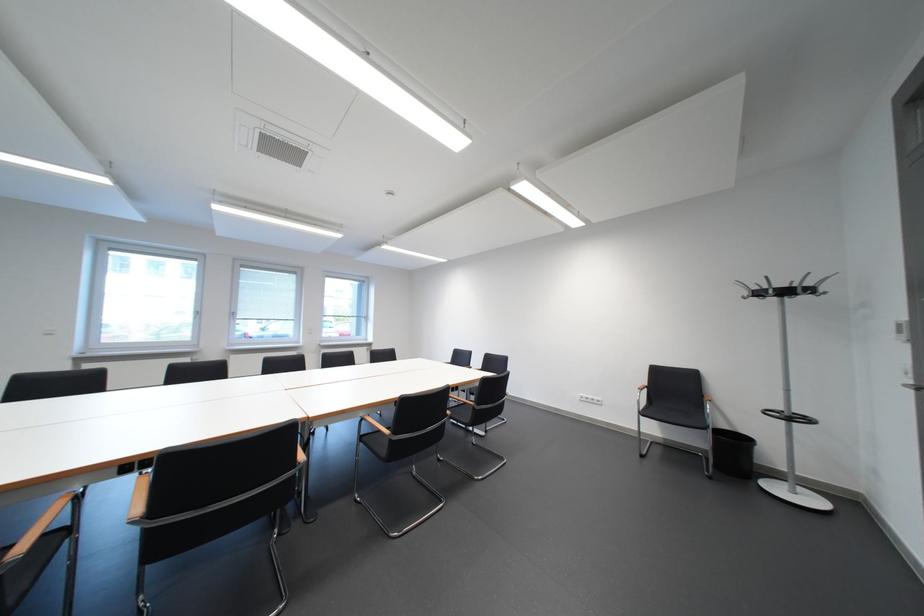
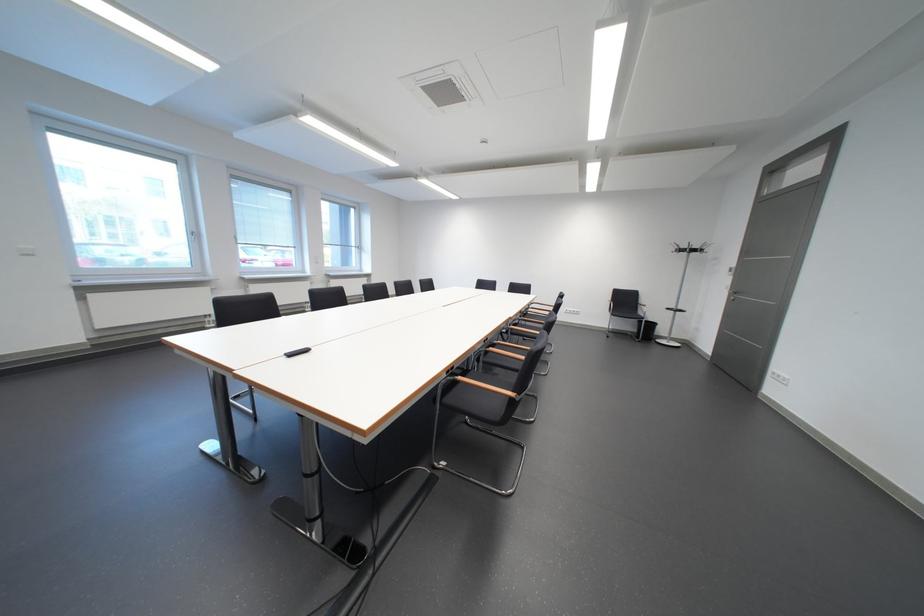
The point at (779, 288) is marked in the first image. Where is the corresponding point in the second image?

(698, 248)